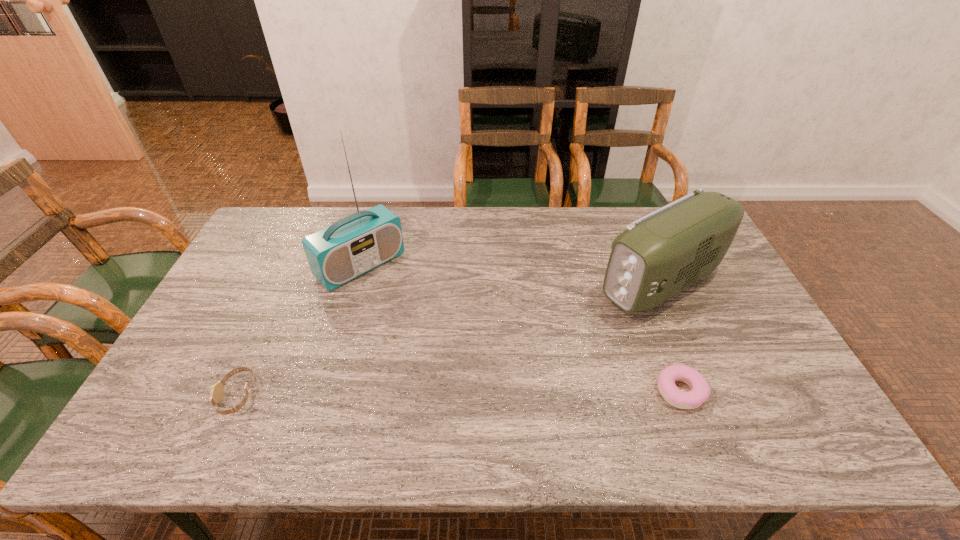
At what (x,y) coordinates should I click in order to perform the action: click on vacant spot on the desktop that is between the leftmost object and the pastry and is positioned on the front-facing side of the third shortest object. Please return your answer as a coordinate pair (x, y). This screenshot has height=540, width=960. Looking at the image, I should click on (474, 393).

The image size is (960, 540). In order to click on vacant space on the desktop that is between the leftmost object and the shortest object and is positioned on the front panel of the taller radio receiver in this screenshot , I will do `click(497, 393)`.